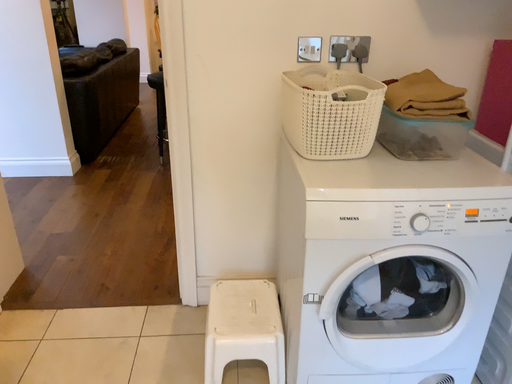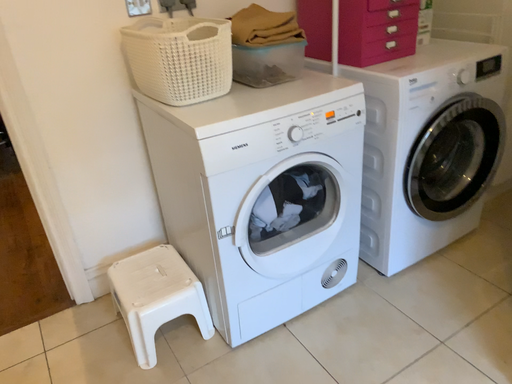
Question: How did the camera likely rotate when shooting the video?

Choices:
 (A) rotated left
 (B) rotated right

Answer: (B)